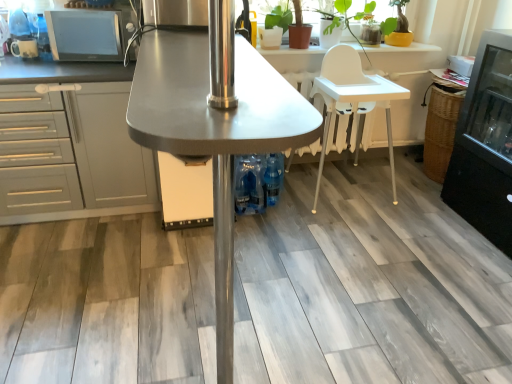
I want to click on free spot to the left of metallic gray table at center, the 1th table viewed from the front, so click(92, 304).